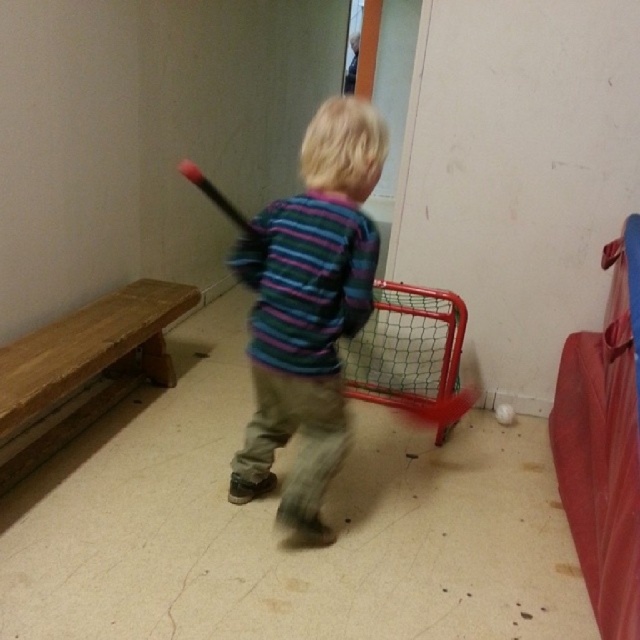
Is striped fabric shirt at center behind smooth plastic bat at center?

No, it is not.

Who is taller, striped fabric shirt at center or smooth plastic bat at center?

With more height is striped fabric shirt at center.

What are the coordinates of `striped fabric shirt at center` in the screenshot? It's located at (308, 308).